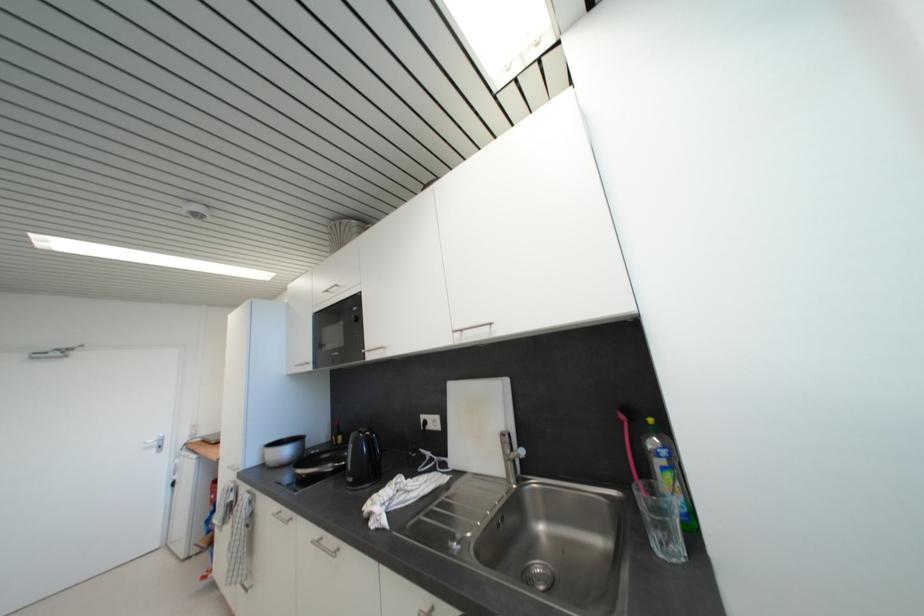
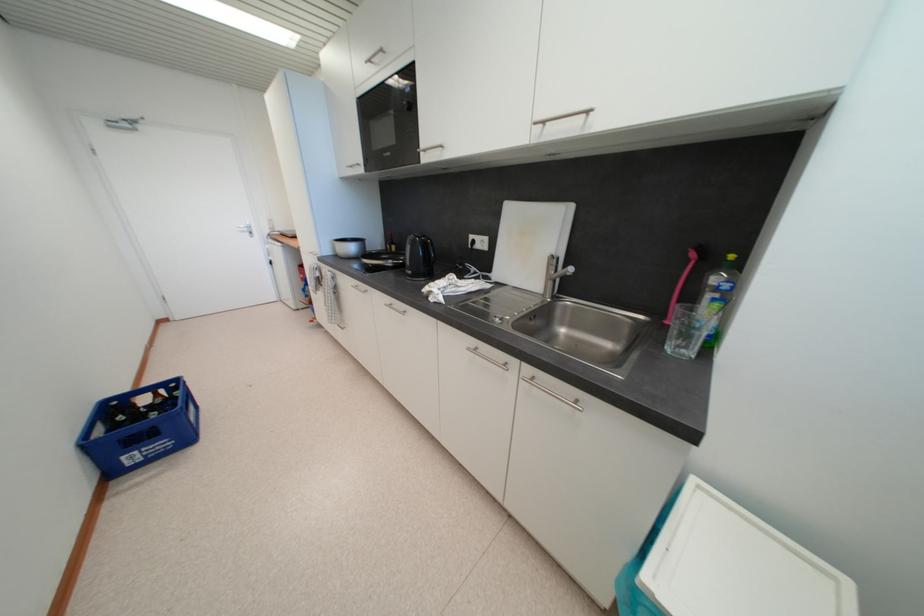
Where in the second image is the point corresponding to [675,477] from the first image?

(723, 307)